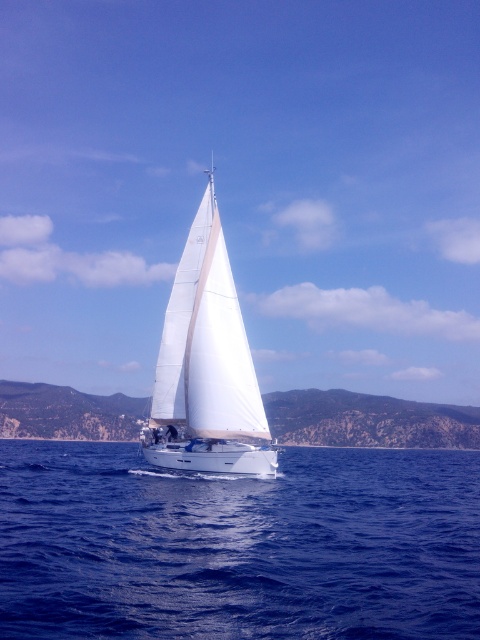
Question: Which point appears closest to the camera in this image?

Choices:
 (A) (239, 353)
 (B) (278, 496)

Answer: (B)

Question: Is blue liquid water at center to the right of white matte sailboat at center from the viewer's perspective?

Choices:
 (A) no
 (B) yes

Answer: (B)

Question: Which object is closer to the camera taking this photo?

Choices:
 (A) white matte sailboat at center
 (B) blue liquid water at center

Answer: (B)

Question: Is blue liquid water at center thinner than white matte sailboat at center?

Choices:
 (A) yes
 (B) no

Answer: (B)

Question: Is blue liquid water at center bigger than white matte sailboat at center?

Choices:
 (A) no
 (B) yes

Answer: (B)